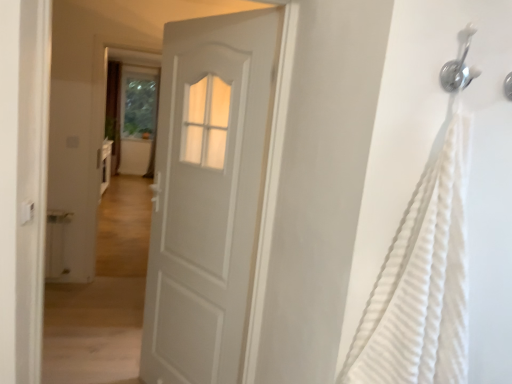
Question: Should I look upward or downward to see transparent glass screen door at upper center?

Choices:
 (A) up
 (B) down

Answer: (A)

Question: Can you confirm if transparent glass screen door at upper center is wider than white matte door at center?

Choices:
 (A) no
 (B) yes

Answer: (B)

Question: From a real-world perspective, does transparent glass screen door at upper center stand above white matte door at center?

Choices:
 (A) no
 (B) yes

Answer: (B)

Question: Is transparent glass screen door at upper center outside of white matte door at center?

Choices:
 (A) yes
 (B) no

Answer: (A)

Question: Is transparent glass screen door at upper center at the right side of white matte door at center?

Choices:
 (A) no
 (B) yes

Answer: (A)

Question: Is transparent glass screen door at upper center in front of white matte door at center?

Choices:
 (A) no
 (B) yes

Answer: (A)

Question: Can white matte door at center be found inside transparent glass screen door at upper center?

Choices:
 (A) no
 (B) yes

Answer: (A)

Question: Does white textured fabric at right come behind transparent glass screen door at upper center?

Choices:
 (A) yes
 (B) no

Answer: (B)

Question: Is transparent glass screen door at upper center located within white textured fabric at right?

Choices:
 (A) yes
 (B) no

Answer: (B)

Question: Would you say white textured fabric at right is a long distance from transparent glass screen door at upper center?

Choices:
 (A) no
 (B) yes

Answer: (B)

Question: Is white textured fabric at right in contact with transparent glass screen door at upper center?

Choices:
 (A) yes
 (B) no

Answer: (B)

Question: Considering the relative positions of white textured fabric at right and transparent glass screen door at upper center in the image provided, is white textured fabric at right to the right of transparent glass screen door at upper center from the viewer's perspective?

Choices:
 (A) yes
 (B) no

Answer: (A)

Question: From a real-world perspective, is white textured fabric at right positioned over transparent glass screen door at upper center based on gravity?

Choices:
 (A) yes
 (B) no

Answer: (A)

Question: Does transparent glass screen door at upper center have a lesser height compared to silver metallic shower head at upper right?

Choices:
 (A) no
 (B) yes

Answer: (A)